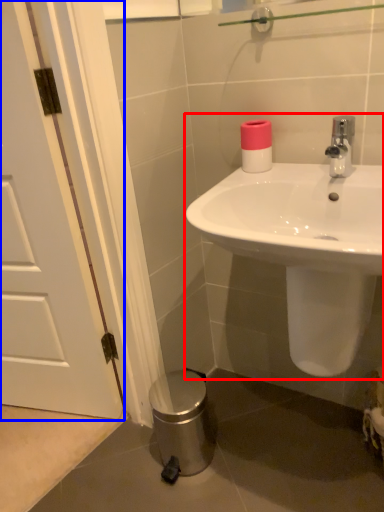
Question: Which object is further to the camera taking this photo, sink (highlighted by a red box) or door (highlighted by a blue box)?

Choices:
 (A) sink
 (B) door

Answer: (B)